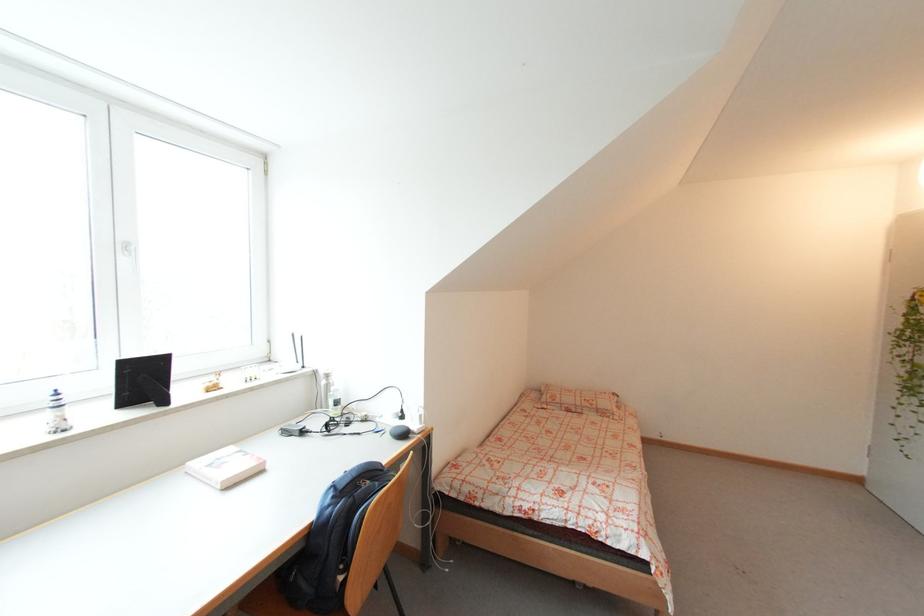
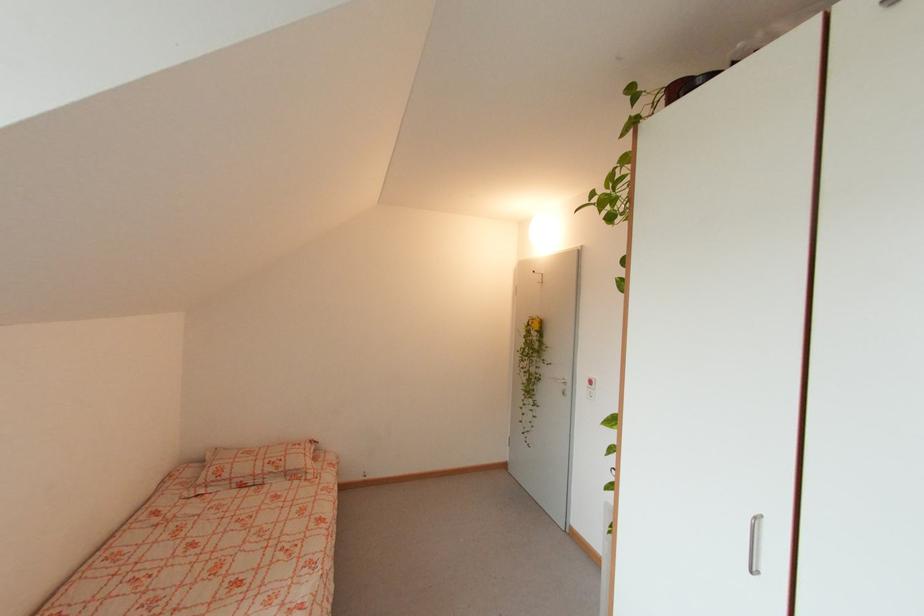
Question: Based on the continuous images, in which direction is the camera rotating? Reply with the corresponding letter.

Choices:
 (A) Left
 (B) Right
 (C) Up
 (D) Down

Answer: (B)